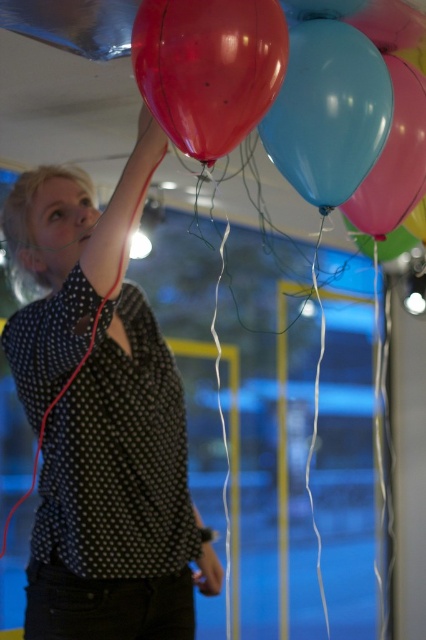
Question: Is glossy rubber balloon at upper center positioned before glossy blue balloon at center?

Choices:
 (A) yes
 (B) no

Answer: (A)

Question: Which point appears closest to the camera in this image?

Choices:
 (A) (333, 115)
 (B) (215, 124)
 (C) (118, 264)

Answer: (B)

Question: Can you confirm if matte black shirt at upper left is smaller than glossy blue balloon at center?

Choices:
 (A) no
 (B) yes

Answer: (A)

Question: Can you confirm if glossy rubber balloon at upper center is smaller than glossy blue balloon at center?

Choices:
 (A) no
 (B) yes

Answer: (B)

Question: Estimate the real-world distances between objects in this image. Which object is closer to the glossy blue balloon at center?

Choices:
 (A) glossy rubber balloon at upper center
 (B) matte black shirt at upper left

Answer: (A)

Question: Among these points, which one is farthest from the camera?

Choices:
 (A) (308, 163)
 (B) (149, 493)

Answer: (B)